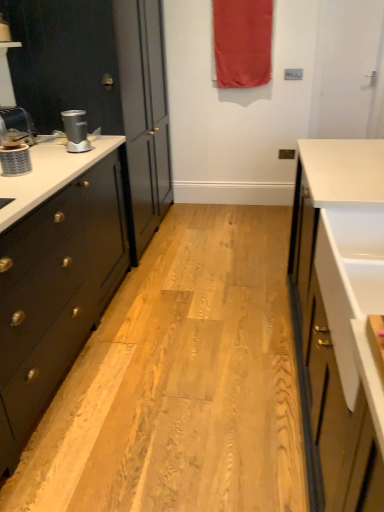
Question: Would you say matte black cabinet at left is inside or outside matte silver blender at left?

Choices:
 (A) outside
 (B) inside

Answer: (A)

Question: From the image's perspective, is matte black cabinet at left positioned above or below matte silver blender at left?

Choices:
 (A) above
 (B) below

Answer: (A)

Question: Which of these objects is positioned farthest from the matte black cabinet at left?

Choices:
 (A) brushed metal faucet at left
 (B) silver metallic coffee machine at left
 (C) red fabric curtain at upper center
 (D) matte silver blender at left

Answer: (D)

Question: Which object is the closest to the silver metallic coffee machine at left?

Choices:
 (A) matte silver blender at left
 (B) red fabric curtain at upper center
 (C) brushed metal faucet at left
 (D) matte black cabinet at left

Answer: (C)